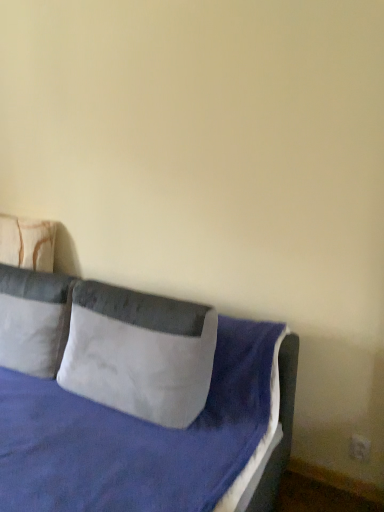
Question: Is white soft pillow at left, positioned as the second pillow in left-to-right order, to the left of gray suede pillow at center, acting as the 3th pillow starting from the left, from the viewer's perspective?

Choices:
 (A) no
 (B) yes

Answer: (B)

Question: From a real-world perspective, is white soft pillow at left, arranged as the 2th pillow when viewed from the right, physically below gray suede pillow at center, which ranks as the first pillow in right-to-left order?

Choices:
 (A) no
 (B) yes

Answer: (B)

Question: Is the position of white soft pillow at left, arranged as the 2th pillow when viewed from the right, less distant than that of gray suede pillow at center, acting as the 3th pillow starting from the left?

Choices:
 (A) no
 (B) yes

Answer: (A)

Question: Does white soft pillow at left, positioned as the second pillow in left-to-right order, turn towards gray suede pillow at center, which ranks as the first pillow in right-to-left order?

Choices:
 (A) yes
 (B) no

Answer: (B)

Question: Considering the relative sizes of white soft pillow at left, positioned as the second pillow in left-to-right order, and gray suede pillow at center, which ranks as the first pillow in right-to-left order, in the image provided, is white soft pillow at left, positioned as the second pillow in left-to-right order, wider than gray suede pillow at center, which ranks as the first pillow in right-to-left order,?

Choices:
 (A) yes
 (B) no

Answer: (A)

Question: Is gray suede pillow at center, acting as the 3th pillow starting from the left, wider or thinner than velvet blue bed at center?

Choices:
 (A) wide
 (B) thin

Answer: (B)

Question: In the image, is gray suede pillow at center, acting as the 3th pillow starting from the left, positioned in front of or behind velvet blue bed at center?

Choices:
 (A) behind
 (B) front

Answer: (A)

Question: Which is correct: gray suede pillow at center, acting as the 3th pillow starting from the left, is inside velvet blue bed at center, or outside of it?

Choices:
 (A) inside
 (B) outside

Answer: (A)

Question: In terms of height, does gray suede pillow at center, which ranks as the first pillow in right-to-left order, look taller or shorter compared to velvet blue bed at center?

Choices:
 (A) short
 (B) tall

Answer: (A)

Question: Considering the relative positions of beige fabric pillow at left, marked as the first pillow in a left-to-right arrangement, and white soft pillow at left, arranged as the 2th pillow when viewed from the right, in the image provided, is beige fabric pillow at left, marked as the first pillow in a left-to-right arrangement, to the left or to the right of white soft pillow at left, arranged as the 2th pillow when viewed from the right,?

Choices:
 (A) left
 (B) right

Answer: (A)

Question: Is beige fabric pillow at left, marked as the first pillow in a left-to-right arrangement, in front of or behind white soft pillow at left, arranged as the 2th pillow when viewed from the right, in the image?

Choices:
 (A) behind
 (B) front

Answer: (A)

Question: Looking at the image, does beige fabric pillow at left, which appears as the third pillow when viewed from the right, seem bigger or smaller compared to white soft pillow at left, arranged as the 2th pillow when viewed from the right?

Choices:
 (A) small
 (B) big

Answer: (A)

Question: Is point click(0, 261) positioned closer to the camera than point click(39, 330)?

Choices:
 (A) farther
 (B) closer

Answer: (A)

Question: In terms of size, does velvet blue bed at center appear bigger or smaller than gray suede pillow at center, which ranks as the first pillow in right-to-left order?

Choices:
 (A) big
 (B) small

Answer: (A)

Question: Is velvet blue bed at center wider or thinner than gray suede pillow at center, acting as the 3th pillow starting from the left?

Choices:
 (A) thin
 (B) wide

Answer: (B)